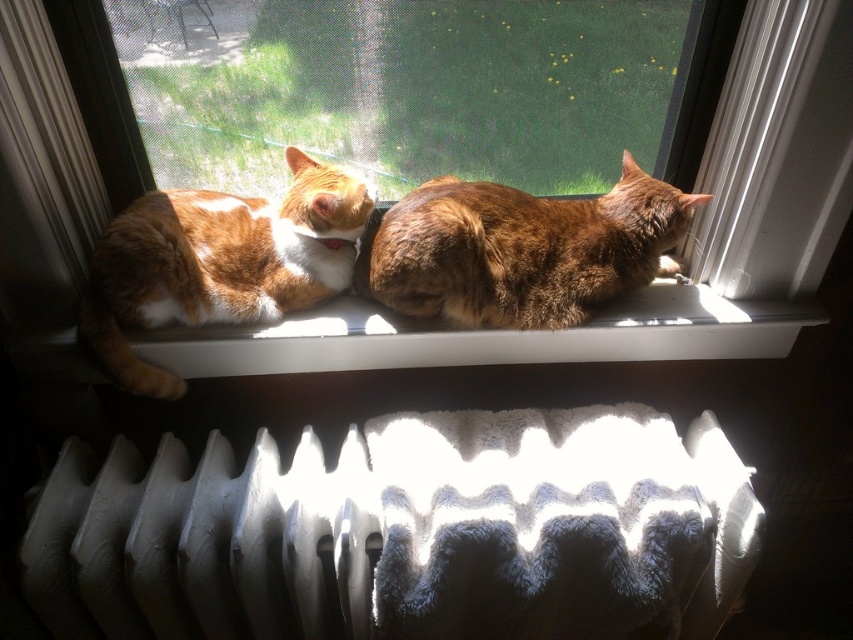
You are a cat owner trying to place a new cat bed in the windowsill. You want to ensure it doesn not block the view for the cats. The cats currently occupy two spots marked by points. Which point, point (120, 358) or point (654, 314), is closer to the window glass where the view is best?

Point (120, 358) is in front of point (654, 314), so it is closer to the window glass and offers the best view.

In the scene shown: You are trying to determine if the clear glass window at center can fully cover the brown furry cat at center if placed directly over it. Based on their sizes, what is your conclusion?

The clear glass window at center is bigger than brown furry cat at center, so yes, it can fully cover the brown furry cat at center.

You are a cat owner who wants to place a new cat bed on the radiator. The bed requires a space of 0.3 meters in width. Can the white textured radiator at lower center accommodate the cat bed?

The white textured radiator at lower center has a width of 0.3 meters, so it can accommodate the cat bed.